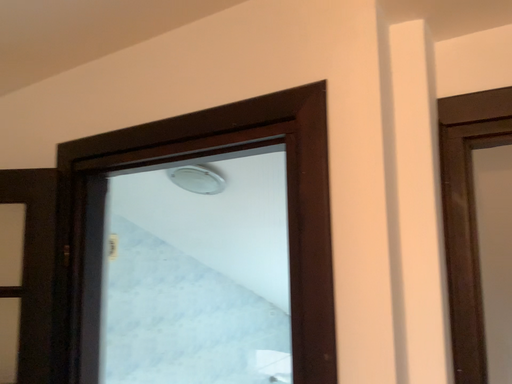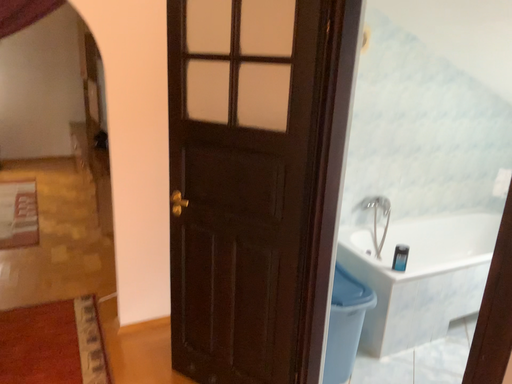
Question: How did the camera likely rotate when shooting the video?

Choices:
 (A) rotated left
 (B) rotated right

Answer: (A)